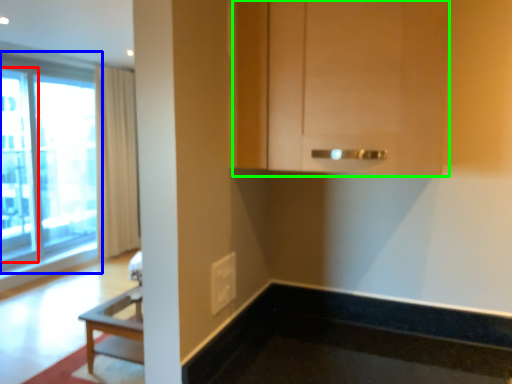
Question: Estimate the real-world distances between objects in this image. Which object is closer to screen door (highlighted by a red box), window (highlighted by a blue box) or cabinetry (highlighted by a green box)?

Choices:
 (A) window
 (B) cabinetry

Answer: (A)